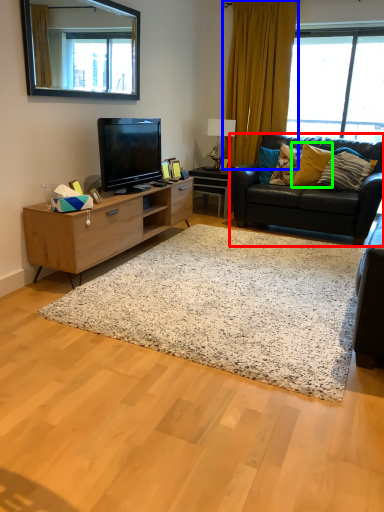
Question: Which is farther away from studio couch (highlighted by a red box)? curtain (highlighted by a blue box) or pillow (highlighted by a green box)?

Choices:
 (A) curtain
 (B) pillow

Answer: (A)